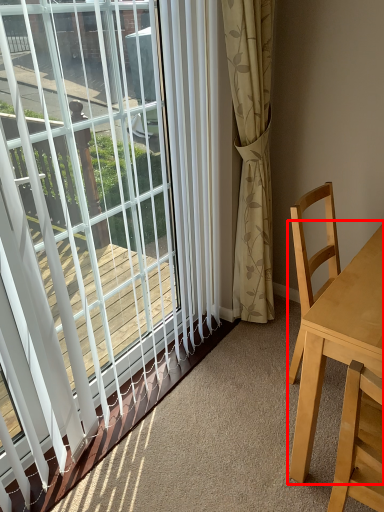
Question: Considering the relative positions of table (annotated by the red box) and window in the image provided, where is table (annotated by the red box) located with respect to the staircase?

Choices:
 (A) right
 (B) left

Answer: (A)